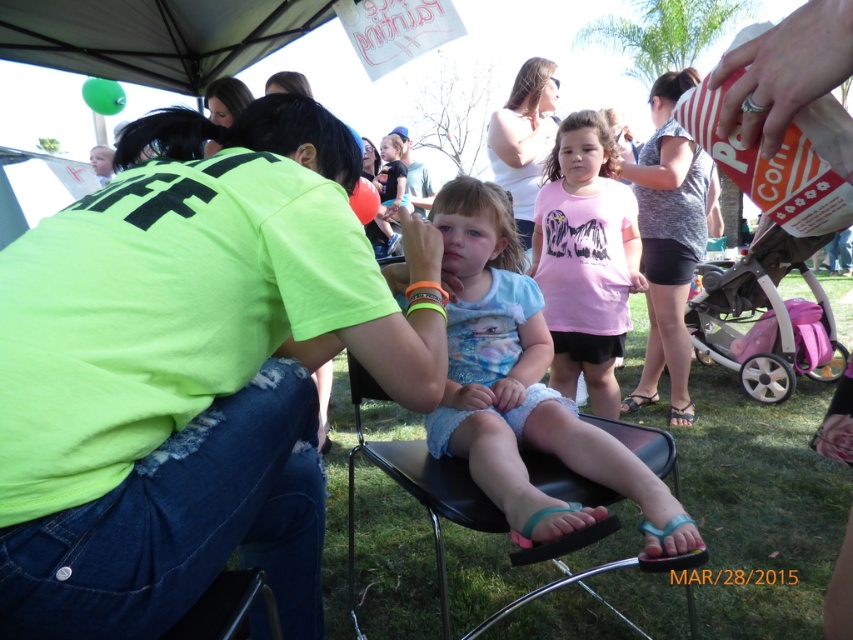
Is neon green t-shirt at center taller than pink fabric baby carriage at right?

Yes, neon green t-shirt at center is taller than pink fabric baby carriage at right.

How distant is neon green t-shirt at center from pink fabric baby carriage at right?

The distance of neon green t-shirt at center from pink fabric baby carriage at right is 9.11 feet.

What do you see at coordinates (186, 372) in the screenshot?
I see `neon green t-shirt at center` at bounding box center [186, 372].

I want to click on neon green t-shirt at center, so click(186, 372).

Does light blue denim shorts at center have a lesser width compared to pink fabric baby carriage at right?

Yes.

Is light blue denim shorts at center above pink fabric baby carriage at right?

Actually, light blue denim shorts at center is below pink fabric baby carriage at right.

Identify the location of light blue denim shorts at center. This screenshot has height=640, width=853. (527, 394).

Can you confirm if light blue denim shorts at center is positioned to the right of white matte shirt at upper center?

Incorrect, light blue denim shorts at center is not on the right side of white matte shirt at upper center.

Is point (500, 196) in front of point (515, 200)?

Yes, it is in front of point (515, 200).

Where is `light blue denim shorts at center`? light blue denim shorts at center is located at coordinates (527, 394).